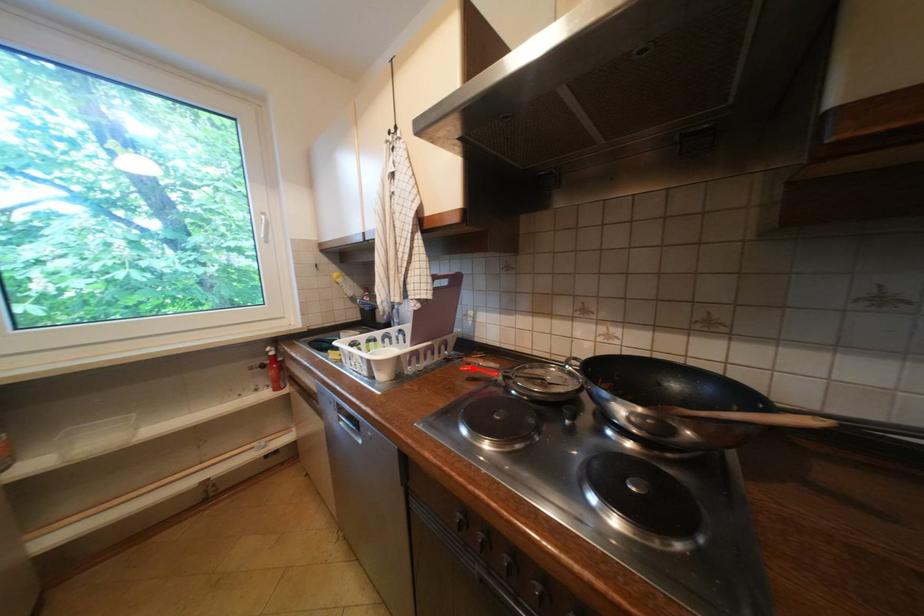
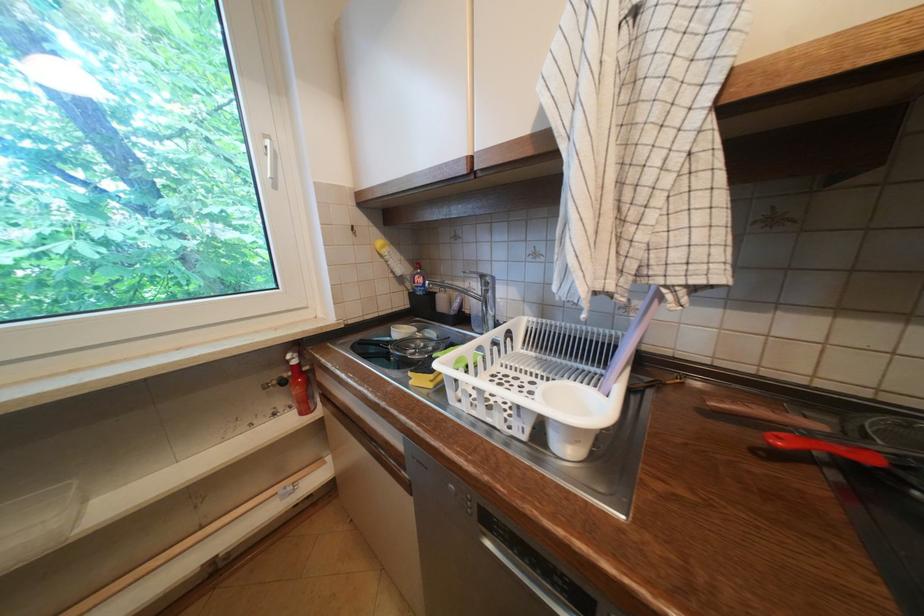
Find the pixel in the second image that matches the highlighted location in the first image.

(788, 440)